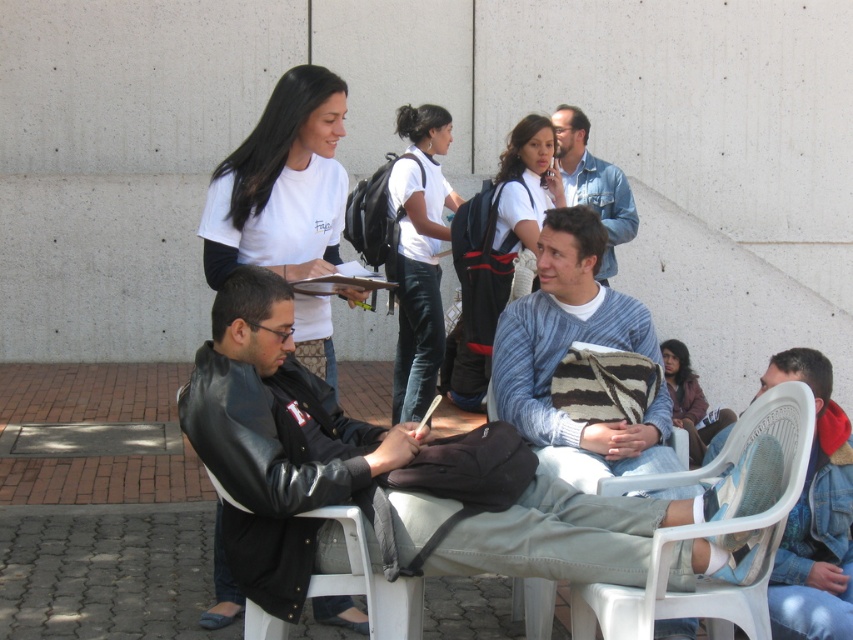
You are a photographer trying to capture a candid shot of both the black leather jacket at center and the knitted blue sweater at center. Since you want to ensure both subjects are in focus, which one should you focus on first, the one closer to you or the one farther away?

You should focus on the knitted blue sweater at center first because it is farther away from you than the black leather jacket at center, which is closer. To ensure both are in focus, start focusing on the farther subject.

Looking at this image, you are organizing a small event and need to know if the knitted blue sweater at center and the white plastic chair at lower right can both fit on a table that can only hold items taking up the space of the chair. Can they both fit?

The knitted blue sweater at center occupies less space than white plastic chair at lower right. Since the table can hold the space of the chair, both items can fit together as the sweater takes up less space than the chair alone.